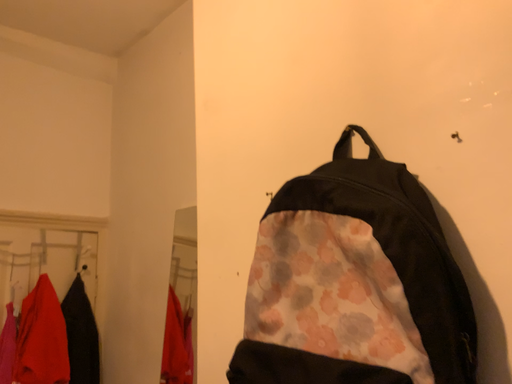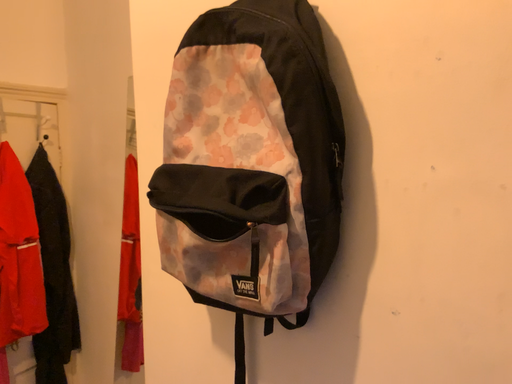
Question: How did the camera likely rotate when shooting the video?

Choices:
 (A) rotated downward
 (B) rotated upward

Answer: (A)